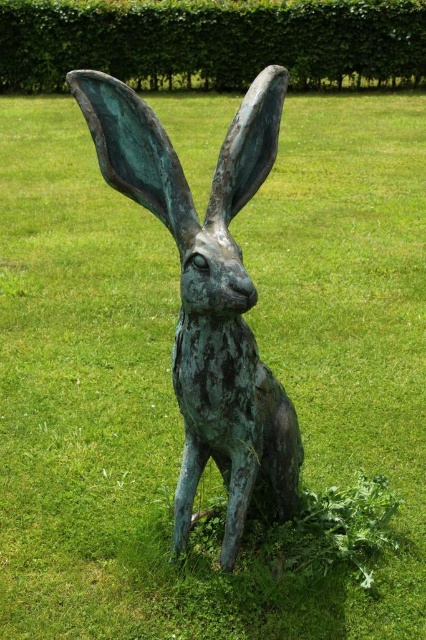
Does green patina bronze hare at center appear over green leafy hedge at upper center?

Actually, green patina bronze hare at center is below green leafy hedge at upper center.

The width and height of the screenshot is (426, 640). Find the location of `green patina bronze hare at center`. green patina bronze hare at center is located at coordinates (207, 294).

Is point (186, 500) closer to camera compared to point (409, 26)?

That is True.

What are the coordinates of `green patina bronze hare at center` in the screenshot? It's located at (207, 294).